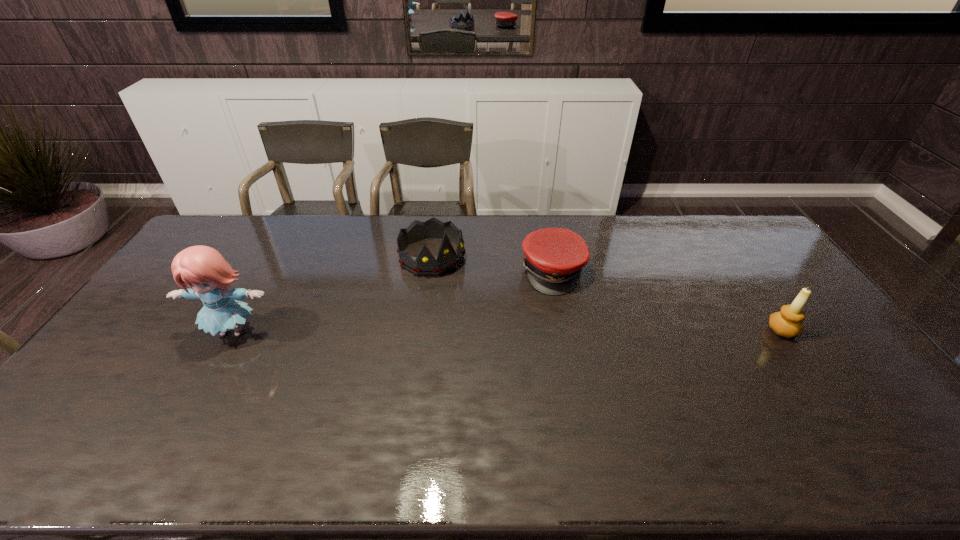
The height and width of the screenshot is (540, 960). Identify the location of free space at the right edge of the desktop. (786, 282).

Find the location of a particular element. This screenshot has width=960, height=540. free space at the far right corner is located at coordinates (739, 218).

Image resolution: width=960 pixels, height=540 pixels. In the image, there is a desktop. Find the location of `vacant region at the near right corner`. vacant region at the near right corner is located at coordinates (834, 410).

Locate an element on the screen. This screenshot has width=960, height=540. vacant space that's between the rightmost object and the leftmost object is located at coordinates (508, 331).

Locate an element on the screen. vacant region between the tiara and the candle_holder is located at coordinates (607, 293).

You are a GUI agent. You are given a task and a screenshot of the screen. Output one action in this format:
    pyautogui.click(x=<x>, y=<y>)
    Task: Click on the unoccupied position between the third object from left to right and the candle_holder
    The height and width of the screenshot is (540, 960).
    Given the screenshot: What is the action you would take?
    pyautogui.click(x=668, y=301)

Where is `vacant area that lies between the candle_holder and the tallest object`? vacant area that lies between the candle_holder and the tallest object is located at coordinates (508, 331).

Where is `free spot between the shortest object and the rightmost object`? Image resolution: width=960 pixels, height=540 pixels. free spot between the shortest object and the rightmost object is located at coordinates (668, 301).

Where is `vacant area between the rightmost object and the second object from right to left`? This screenshot has width=960, height=540. vacant area between the rightmost object and the second object from right to left is located at coordinates (668, 301).

At what (x,y) coordinates should I click in order to perform the action: click on vacant point located between the third object from left to right and the rightmost object. Please return your answer as a coordinate pair (x, y). Image resolution: width=960 pixels, height=540 pixels. Looking at the image, I should click on (668, 301).